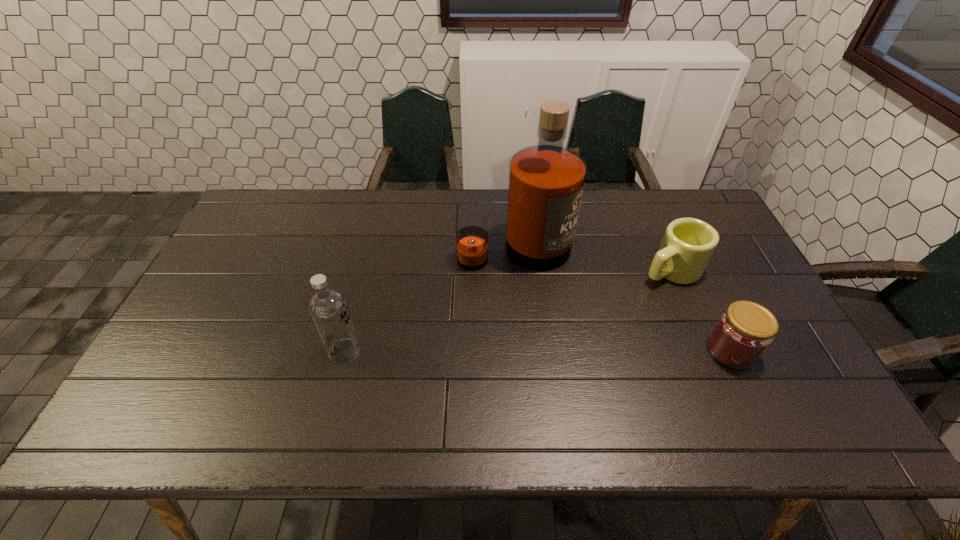
This screenshot has width=960, height=540. I want to click on free region located 0.350m on the front label of the tallest object, so click(x=600, y=364).

At what (x,y) coordinates should I click in order to perform the action: click on vacant space positioned 0.200m with the handle on the side of the mug. Please return your answer as a coordinate pair (x, y). Looking at the image, I should click on (598, 308).

Identify the location of free space located with the handle on the side of the mug. This screenshot has height=540, width=960. (541, 340).

Image resolution: width=960 pixels, height=540 pixels. I want to click on vacant position located 0.300m with the handle on the side of the mug, so click(x=571, y=323).

The height and width of the screenshot is (540, 960). Find the location of `object present at the far edge`. object present at the far edge is located at coordinates (546, 181).

At what (x,y) coordinates should I click in order to perform the action: click on object present at the near edge. Please return your answer as a coordinate pair (x, y). Image resolution: width=960 pixels, height=540 pixels. Looking at the image, I should click on (744, 331).

Find the location of a particular element. Image resolution: width=960 pixels, height=540 pixels. jam present at the right edge is located at coordinates (744, 331).

At what (x,y) coordinates should I click in order to perform the action: click on mug at the right edge. Please return your answer as a coordinate pair (x, y). This screenshot has height=540, width=960. Looking at the image, I should click on (688, 244).

This screenshot has height=540, width=960. Find the location of `object that is at the near right corner`. object that is at the near right corner is located at coordinates (744, 331).

Find the location of a particular element. free location at the far edge of the desktop is located at coordinates (479, 217).